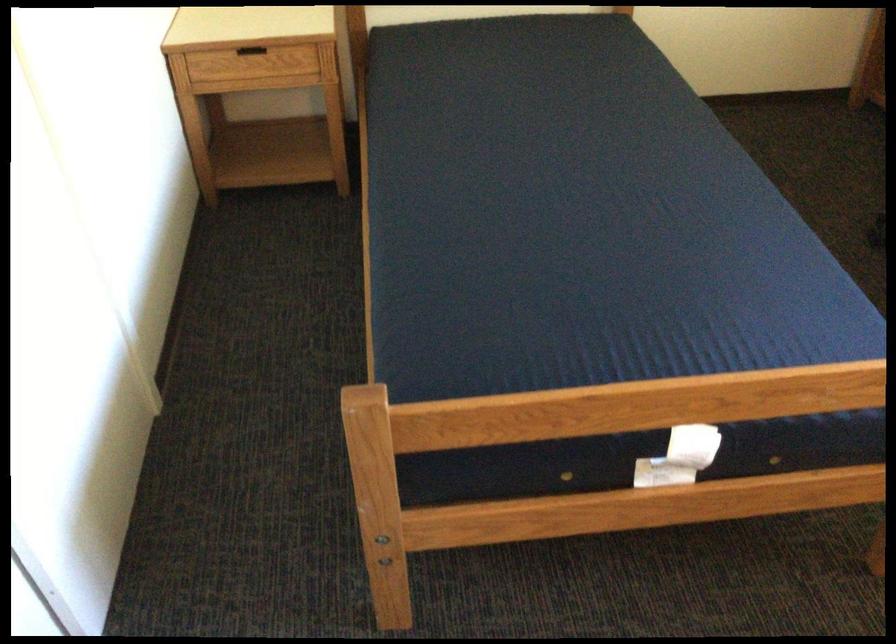
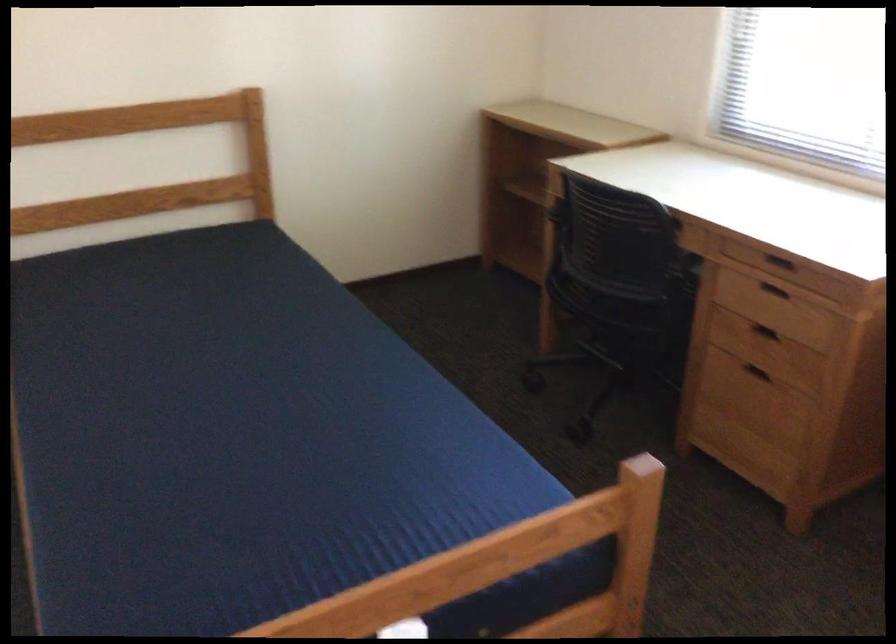
Question: The camera is either moving clockwise (left) or counter-clockwise (right) around the object. The first image is from the beginning of the video and the second image is from the end. Is the camera moving left or right when shooting the video?

Choices:
 (A) Left
 (B) Right

Answer: (A)